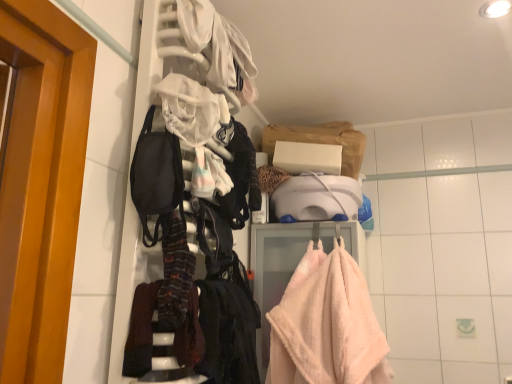
Question: Is black fabric at center not inside soft pink plush towel at center?

Choices:
 (A) no
 (B) yes

Answer: (B)

Question: Does black fabric at center have a lesser height compared to soft pink plush towel at center?

Choices:
 (A) yes
 (B) no

Answer: (A)

Question: From a real-world perspective, is black fabric at center physically below soft pink plush towel at center?

Choices:
 (A) yes
 (B) no

Answer: (A)

Question: Does black fabric at center have a greater height compared to soft pink plush towel at center?

Choices:
 (A) no
 (B) yes

Answer: (A)

Question: From the image's perspective, is black fabric at center on top of soft pink plush towel at center?

Choices:
 (A) yes
 (B) no

Answer: (A)

Question: From the image's perspective, is black fabric at center under soft pink plush towel at center?

Choices:
 (A) no
 (B) yes

Answer: (A)

Question: Is soft pink plush towel at center in front of black fabric at center?

Choices:
 (A) no
 (B) yes

Answer: (A)

Question: Is soft pink plush towel at center not inside black fabric at center?

Choices:
 (A) yes
 (B) no

Answer: (A)

Question: Is soft pink plush towel at center far away from black fabric at center?

Choices:
 (A) no
 (B) yes

Answer: (A)

Question: Considering the relative sizes of soft pink plush towel at center and black fabric at center in the image provided, is soft pink plush towel at center wider than black fabric at center?

Choices:
 (A) no
 (B) yes

Answer: (B)

Question: Can you confirm if soft pink plush towel at center is thinner than black fabric at center?

Choices:
 (A) yes
 (B) no

Answer: (B)

Question: Does soft pink plush towel at center have a smaller size compared to black fabric at center?

Choices:
 (A) no
 (B) yes

Answer: (A)

Question: Is black fabric at center smaller than black fabric mask at left?

Choices:
 (A) yes
 (B) no

Answer: (B)